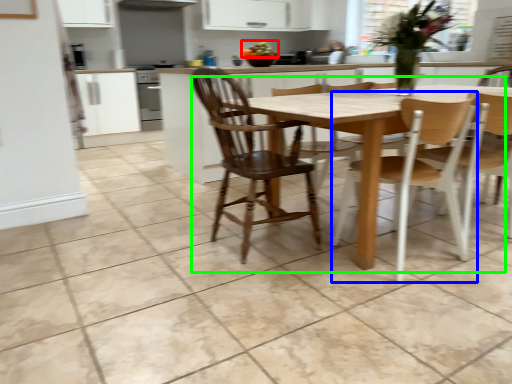
Question: Which is nearer to the food (highlighted by a red box)? chair (highlighted by a blue box) or kitchen & dining room table (highlighted by a green box).

Choices:
 (A) chair
 (B) kitchen & dining room table

Answer: (B)